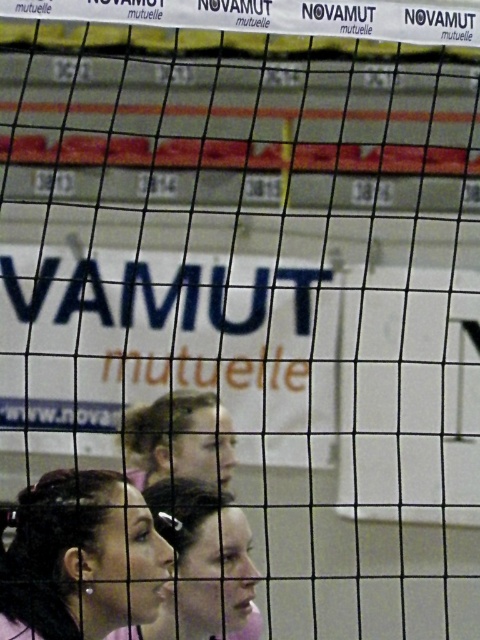
Does matte pink shirt at lower left appear on the right side of pink fabric at lower center?

Incorrect, matte pink shirt at lower left is not on the right side of pink fabric at lower center.

Does matte pink shirt at lower left appear under pink fabric at lower center?

Actually, matte pink shirt at lower left is above pink fabric at lower center.

The height and width of the screenshot is (640, 480). Identify the location of matte pink shirt at lower left. (81, 557).

In the scene shown: Between pink fabric at lower center and blonde hair at center, which one has less height?

blonde hair at center is shorter.

Consider the image. Can you confirm if pink fabric at lower center is positioned to the right of blonde hair at center?

Indeed, pink fabric at lower center is positioned on the right side of blonde hair at center.

Measure the distance between pink fabric at lower center and camera.

The distance of pink fabric at lower center from camera is 5.14 meters.

In order to click on pink fabric at lower center in this screenshot , I will do `click(206, 557)`.

Is matte pink shirt at lower left smaller than blonde hair at center?

Yes.

Looking at this image, between matte pink shirt at lower left and blonde hair at center, which one appears on the right side from the viewer's perspective?

blonde hair at center is more to the right.

Locate an element on the screen. Image resolution: width=480 pixels, height=640 pixels. matte pink shirt at lower left is located at coordinates (81, 557).